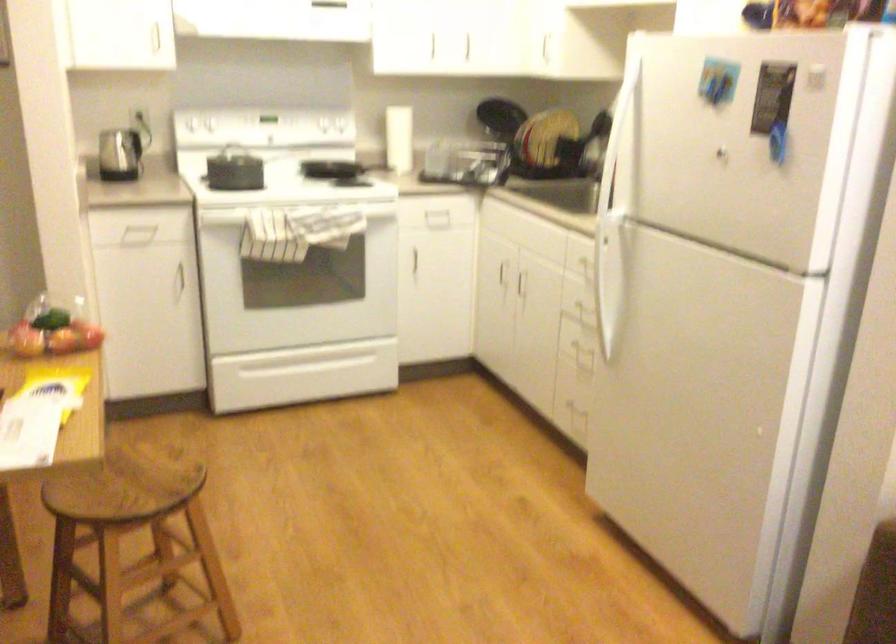
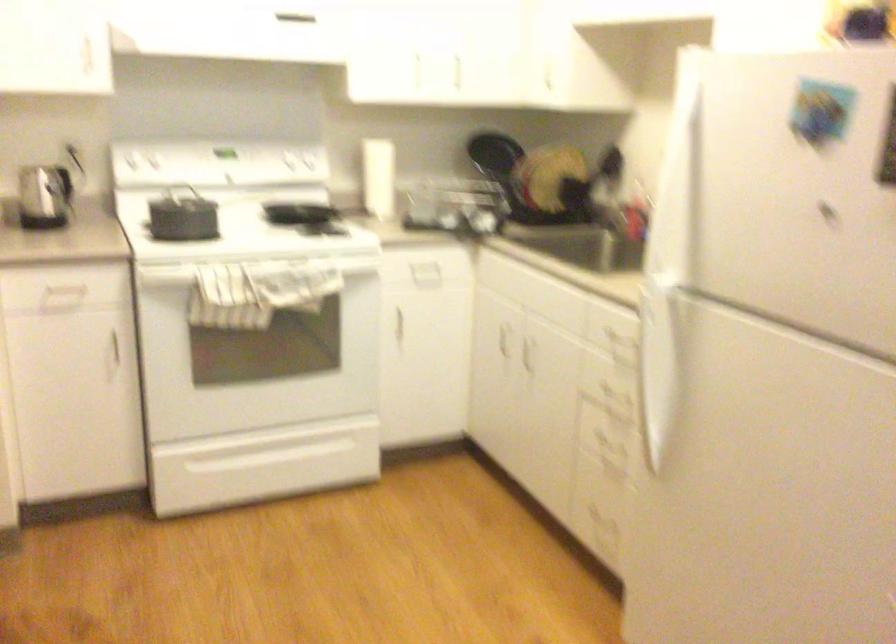
The point at (195,175) is marked in the first image. Where is the corresponding point in the second image?

(141, 225)